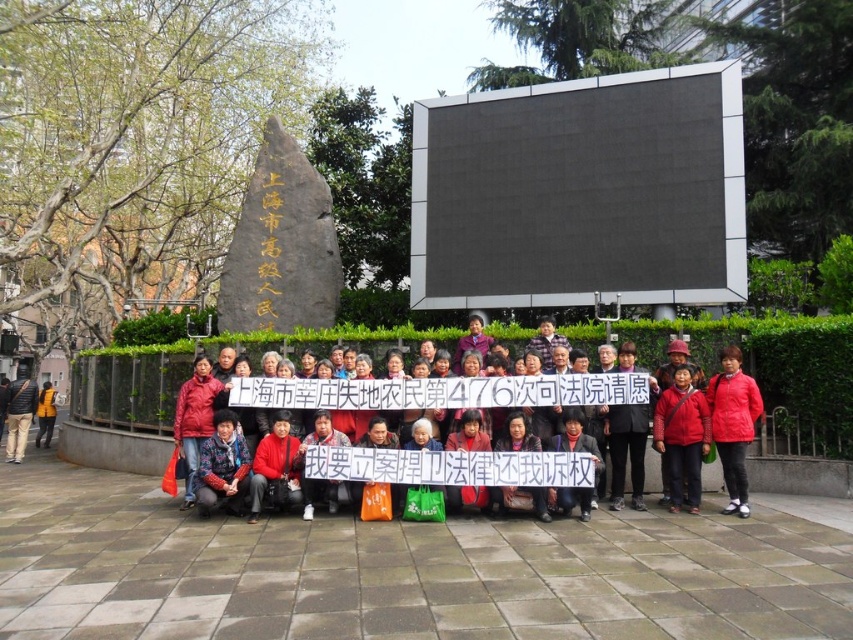
Question: Which point is closer to the camera?

Choices:
 (A) matte black jacket at left
 (B) matte red jacket at lower right

Answer: (B)

Question: Does matte red jacket at lower right come behind yellow fabric jacket at lower left?

Choices:
 (A) no
 (B) yes

Answer: (A)

Question: Which is farther from the matte red jacket at lower right?

Choices:
 (A) yellow fabric jacket at lower left
 (B) matte black jacket at left
 (C) matte red jacket at center
 (D) red fabric coat at center

Answer: (A)

Question: Can you confirm if red fabric coat at center is smaller than matte black jacket at left?

Choices:
 (A) yes
 (B) no

Answer: (A)

Question: Is red fabric coat at center wider than matte black jacket at left?

Choices:
 (A) no
 (B) yes

Answer: (A)

Question: Among these objects, which one is nearest to the camera?

Choices:
 (A) matte red jacket at center
 (B) yellow fabric jacket at lower left
 (C) matte red jacket at lower right

Answer: (C)